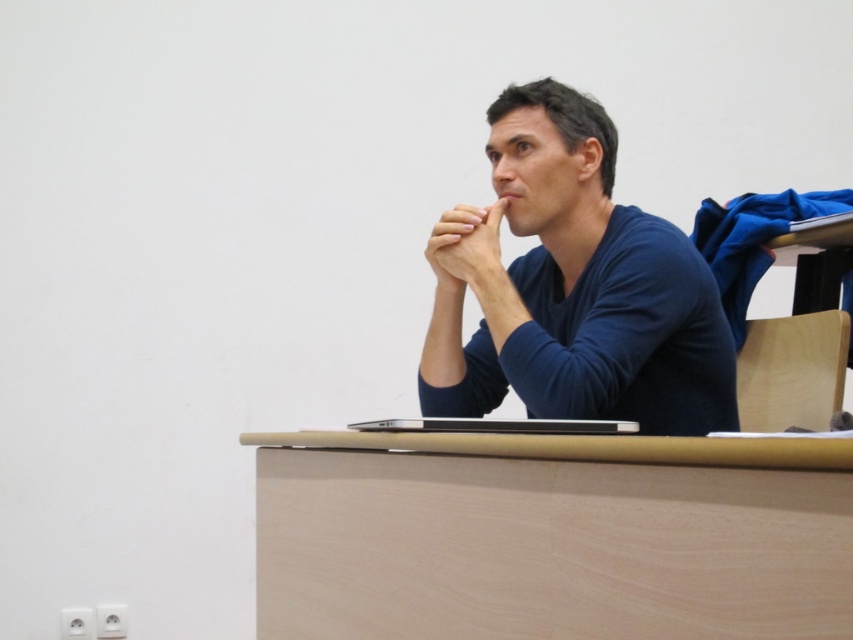
You are trying to place a small notebook on the desk. The notebook is too big for the space between the light brown wood table at center and the blue matte sweater at center. Which object should you move to make more space?

The blue matte sweater at center is on the right side of the light brown wood table at center, so moving it would create more space.

You are trying to place a rectangular object on the light brown wood table at center. The object is as wide as the smooth skin hand at center. Will it fit on the table?

The light brown wood table at center is wider than the smooth skin hand at center, so the object will fit on the table.

You are standing in the classroom and want to place a small plant on the light brown wood table at center. The plant requires a space of at least 0.1 units in both x and y directions. Can you determine if there is enough space at the point indicated by coordinates point [550,536]?

The point [550,536] indicates the location of the light brown wood table at center. Since the plant requires 0.1 units in both x and y directions, and the table is a flat surface, there should be sufficient space available at that coordinate for the plant.